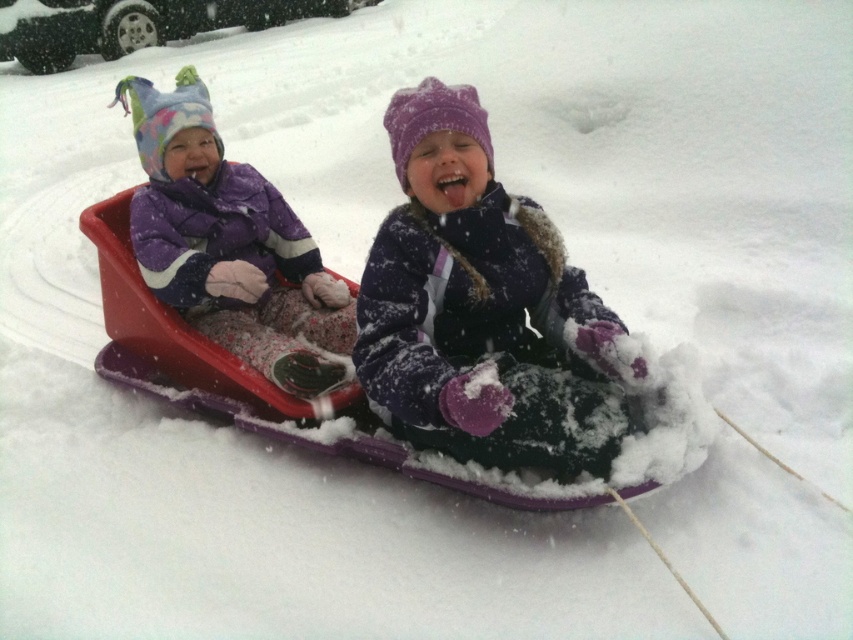
You are standing at the bottom of the snowy hill and see two points marked in the image. The first point is at coordinates point (x=462, y=337) and the second point is at point (x=183, y=244). Which point is closer to you?

Point (x=462, y=337) is in front of point (x=183, y=244), so the first point is closer to you.

You are standing at the point marked by the coordinates point (525, 372) and want to throw a snowball to a friend who is standing 3 meters away from you. Can you reach your friend with the snowball?

The distance between you and the viewer is 2.58 meters, so yes, you can reach your friend with the snowball since 2.58 meters is less than 3 meters.

You are a photographer trying to capture both the purple fuzzy coat at center and the matte purple snowsuit at left in a single shot. Based on their positions, which one should you adjust your camera angle to focus on first to ensure both are in frame?

The purple fuzzy coat at center is to the right of matte purple snowsuit at left. To capture both in a single shot, adjust your camera angle to focus on the matte purple snowsuit at left first, then pan towards the purple fuzzy coat at center to ensure both are included in the frame.